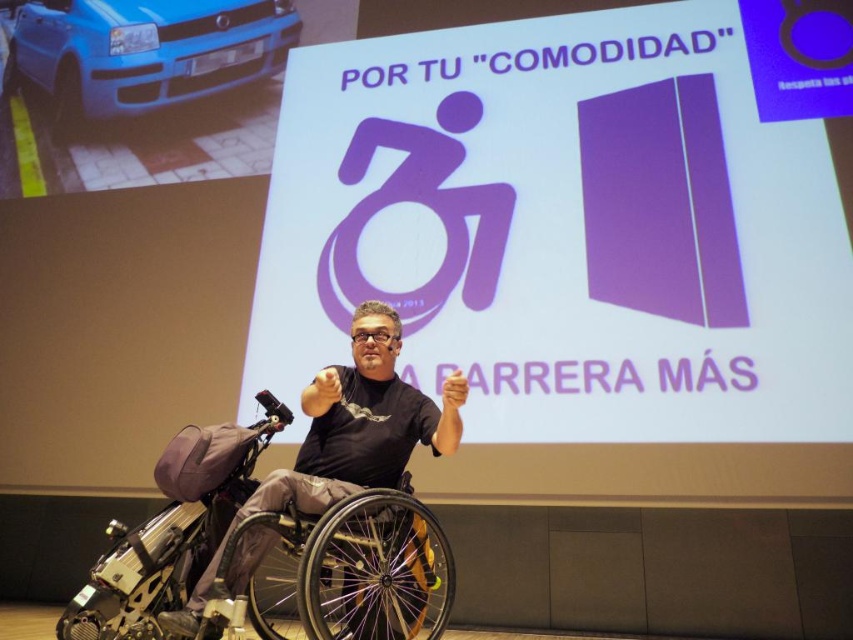
Does purple matte projection screen at upper center have a lesser width compared to silver metallic wheelchair at center?

No, purple matte projection screen at upper center is not thinner than silver metallic wheelchair at center.

Between point (335, 92) and point (416, 554), which one is positioned behind?

The point (335, 92) is behind.

You are a GUI agent. You are given a task and a screenshot of the screen. Output one action in this format:
    pyautogui.click(x=<x>, y=<y>)
    Task: Click on the purple matte projection screen at upper center
    The width and height of the screenshot is (853, 640).
    Given the screenshot: What is the action you would take?
    pyautogui.click(x=570, y=225)

Does purple matte projection screen at upper center have a smaller size compared to blue matte car at upper left?

Actually, purple matte projection screen at upper center might be larger than blue matte car at upper left.

What do you see at coordinates (570, 225) in the screenshot? This screenshot has height=640, width=853. I see `purple matte projection screen at upper center` at bounding box center [570, 225].

Where is `purple matte projection screen at upper center`? The image size is (853, 640). purple matte projection screen at upper center is located at coordinates click(x=570, y=225).

Who is shorter, silver metallic wheelchair at center or blue matte car at upper left?

silver metallic wheelchair at center

Between silver metallic wheelchair at center and blue matte car at upper left, which one has more height?

Standing taller between the two is blue matte car at upper left.

Describe the element at coordinates (279, 561) in the screenshot. I see `silver metallic wheelchair at center` at that location.

This screenshot has width=853, height=640. What are the coordinates of `silver metallic wheelchair at center` in the screenshot? It's located at (279, 561).